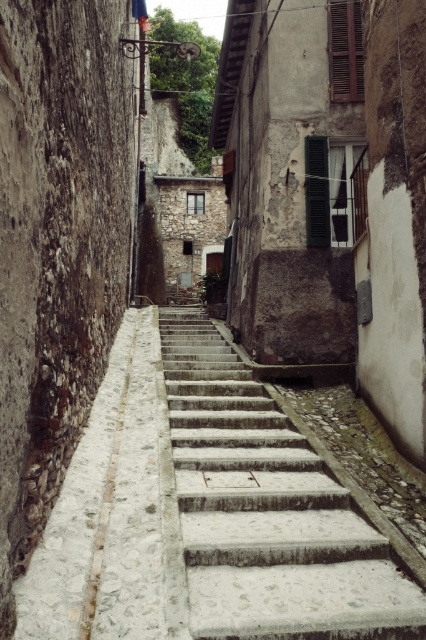
Describe the element at coordinates (267, 512) in the screenshot. I see `smooth concrete stairs at center` at that location.

Consider the image. Who is more distant from viewer, (368, 602) or (126, 378)?

The point (126, 378) is behind.

I want to click on smooth concrete stairs at center, so click(267, 512).